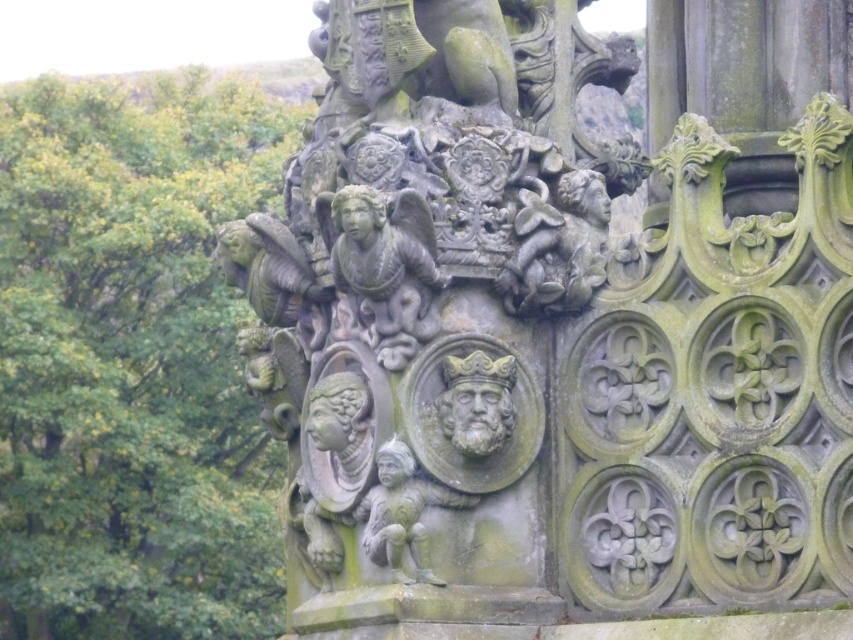
You are standing 132.92 meters away from the green mossy stone tree at upper left. If you want to take a photo of it, would you need to use a zoom lens?

The green mossy stone tree at upper left and camera are 132.92 meters apart. To capture the tree clearly from this distance, you would need to use a zoom lens.

You are an archaeologist examining the monument. You notice the green mossy stone tree at upper left and the gray stone figure at center. Which of these two objects is positioned to the left side of the monument?

The green mossy stone tree at upper left is positioned to the left of the gray stone figure at center, so it is the one on the left side of the monument.

You are standing in front of a stone monument and see a point marked at coordinates (132, 362). What does this point represent?

The point at (132, 362) represents the green mossy stone tree at upper left.